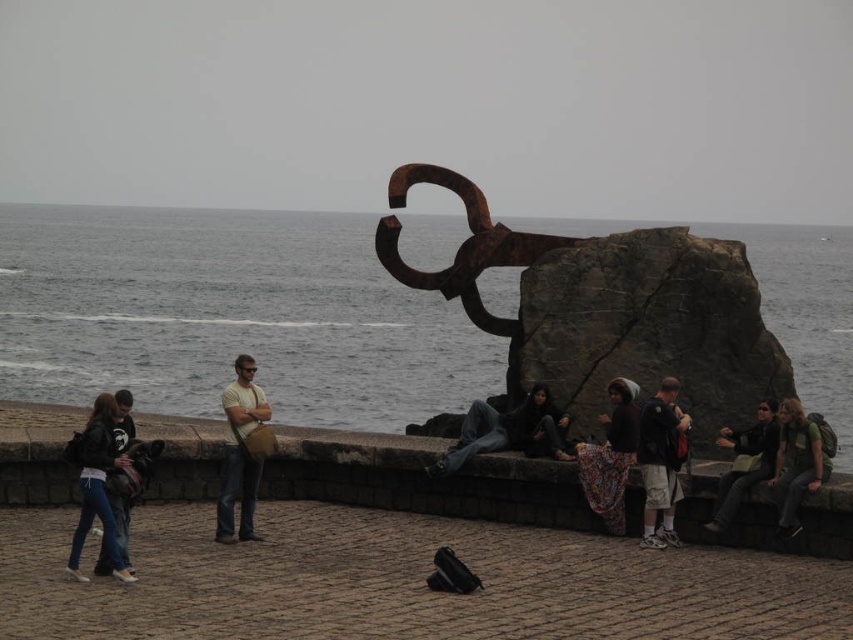
Which of these two, rusty metal hook at center or dark gray fabric pants at center, stands taller?

Standing taller between the two is rusty metal hook at center.

Can you confirm if rusty metal hook at center is taller than dark gray fabric pants at center?

Yes.

Is point (733, 314) positioned behind point (453, 458)?

Yes, point (733, 314) is farther from viewer.

Locate an element on the screen. Image resolution: width=853 pixels, height=640 pixels. rusty metal hook at center is located at coordinates (608, 308).

Can you confirm if matte black jacket at lower left is positioned to the left of dark gray fabric jacket at lower right?

Yes, matte black jacket at lower left is to the left of dark gray fabric jacket at lower right.

Is matte black jacket at lower left positioned before dark gray fabric jacket at lower right?

Yes.

The image size is (853, 640). In order to click on matte black jacket at lower left in this screenshot , I will do `click(97, 484)`.

Where is `gray water at upper center`? gray water at upper center is located at coordinates (228, 316).

Does gray water at upper center lie in front of floral fabric scarf at center?

No, gray water at upper center is further to the viewer.

You are a GUI agent. You are given a task and a screenshot of the screen. Output one action in this format:
    pyautogui.click(x=<x>, y=<y>)
    Task: Click on the gray water at upper center
    This screenshot has width=853, height=640.
    Given the screenshot: What is the action you would take?
    pyautogui.click(x=228, y=316)